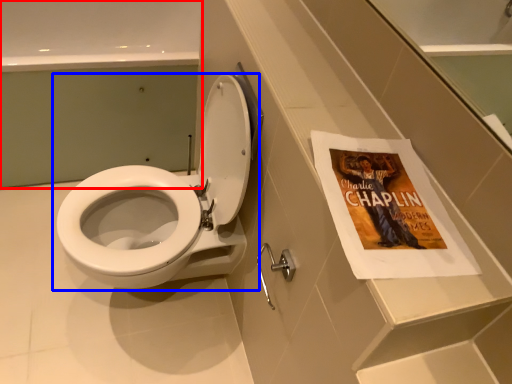
Question: Which point is closer to the camera, bath (highlighted by a red box) or toilet (highlighted by a blue box)?

Choices:
 (A) bath
 (B) toilet

Answer: (B)